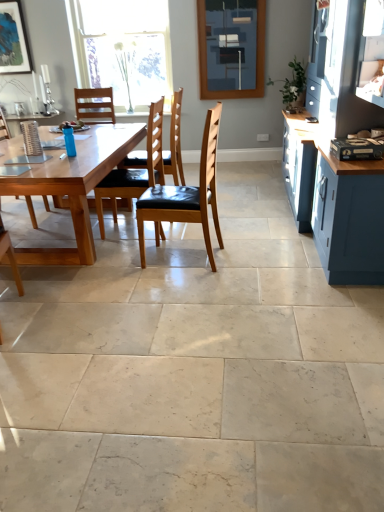
Question: From a real-world perspective, relative to wooden chair at left, arranged as the fourth chair when viewed from the right, is natural wood table at center vertically above or below?

Choices:
 (A) below
 (B) above

Answer: (A)

Question: In the image, is natural wood table at center on the left side or the right side of wooden chair at left, arranged as the fourth chair when viewed from the right?

Choices:
 (A) right
 (B) left

Answer: (A)

Question: Estimate the real-world distances between objects in this image. Which object is farther from the natural wood table at center?

Choices:
 (A) matte blue cabinet at right
 (B) wooden chair at left, arranged as the fourth chair when viewed from the right
 (C) matte glass window screen at upper center
 (D) wooden chair at center, marked as the third chair in a right-to-left arrangement
 (E) wooden chair with black cushion at center, the 2th chair viewed from the right

Answer: (C)

Question: Which of these objects is positioned closest to the brown leather chair at center, the first chair from the right?

Choices:
 (A) wooden chair at center, acting as the second chair starting from the left
 (B) wooden chair at left, arranged as the fourth chair when viewed from the right
 (C) natural wood table at center
 (D) wooden chair with black cushion at center, which is the 3th chair from left to right
 (E) matte glass window screen at upper center

Answer: (C)